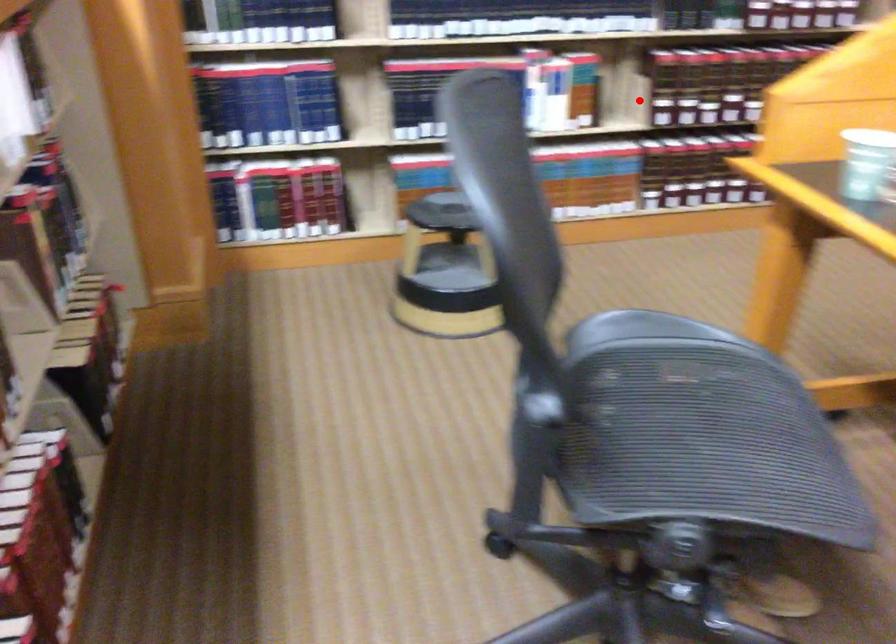
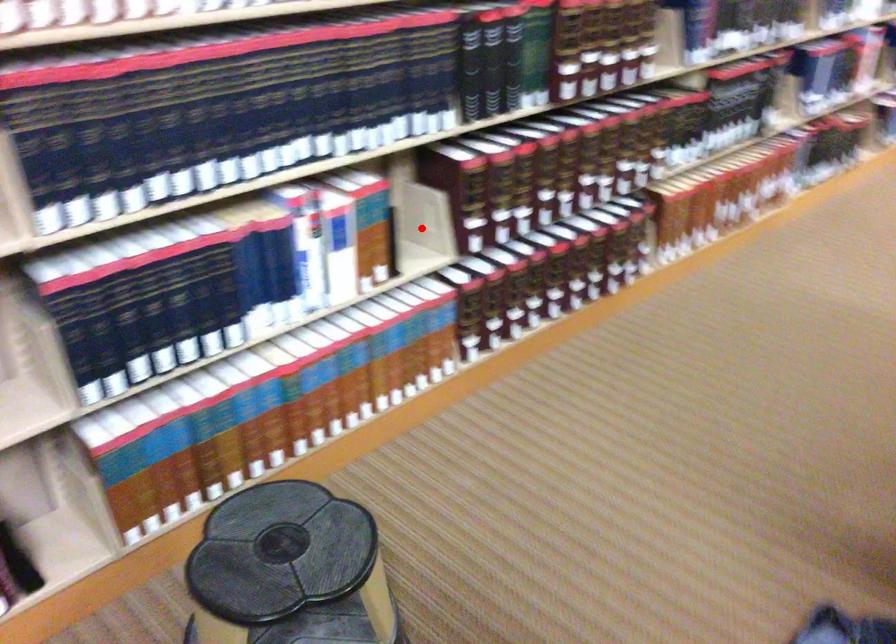
I am providing you with two images of the same scene from different viewpoints. A red point is marked on the first image and another point is marked on the second image. Are the points marked in image1 and image2 representing the same 3D position?

Yes